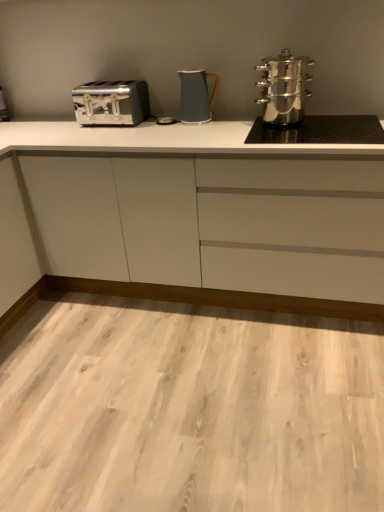
Identify the location of vacant space situated on the left part of matte blue pitcher at center, marked as the first kitchen appliance in a left-to-right arrangement. The height and width of the screenshot is (512, 384). (161, 129).